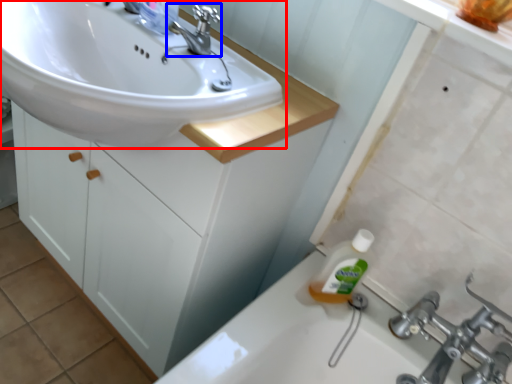
Question: Which of the following is the closest to the observer, sink (highlighted by a red box) or tap (highlighted by a blue box)?

Choices:
 (A) sink
 (B) tap

Answer: (A)